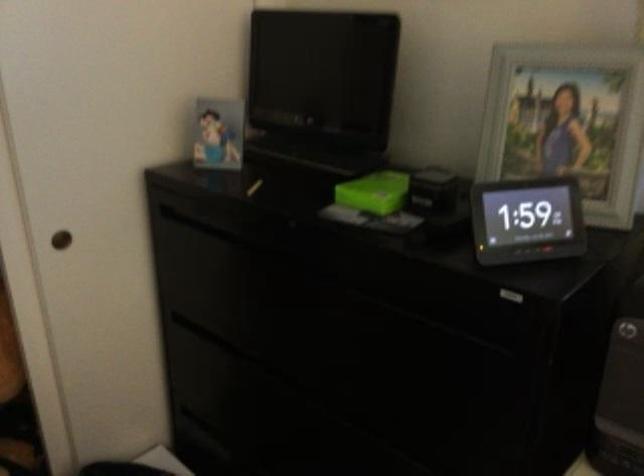
You are a GUI agent. You are given a task and a screenshot of the screen. Output one action in this format:
    pyautogui.click(x=<x>, y=<y>)
    Task: Click on the black laptop
    The image size is (644, 476).
    Given the screenshot: What is the action you would take?
    pyautogui.click(x=319, y=89)